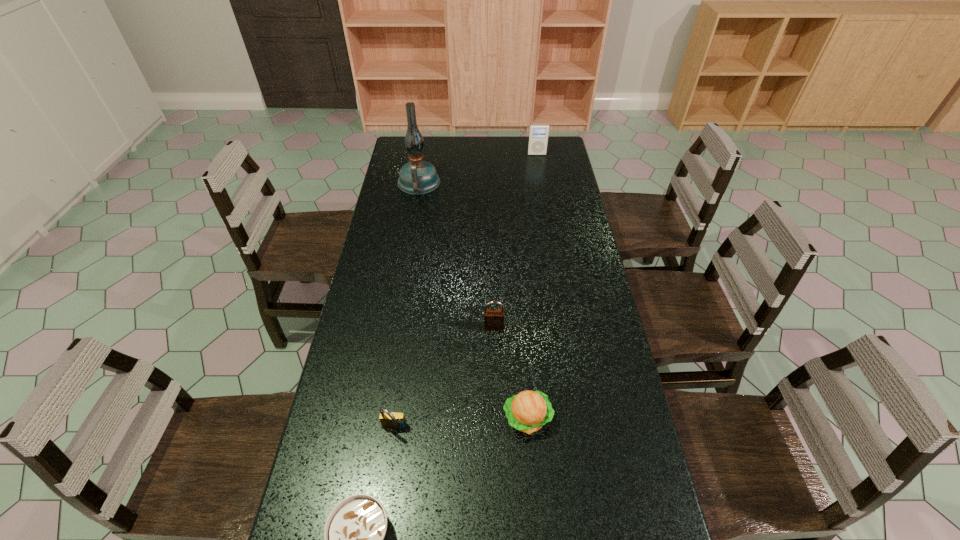
Image resolution: width=960 pixels, height=540 pixels. In order to click on free space located 0.110m on the front-facing side of the rightmost object in this screenshot , I will do `click(540, 169)`.

Identify the location of free space located 0.050m on the front-facing side of the farther padlock. Image resolution: width=960 pixels, height=540 pixels. (494, 345).

Locate an element on the screen. Image resolution: width=960 pixels, height=540 pixels. vacant space located on the side with the combination dials of the shorter padlock is located at coordinates (387, 483).

The image size is (960, 540). In order to click on vacant space located on the back of the hamburger in this screenshot , I will do `click(520, 334)`.

Where is `object at the far edge`? object at the far edge is located at coordinates (538, 136).

Locate an element on the screen. The height and width of the screenshot is (540, 960). oil lamp at the left edge is located at coordinates (417, 177).

The width and height of the screenshot is (960, 540). What are the coordinates of `padlock located in the left edge section of the desktop` in the screenshot? It's located at (392, 420).

The image size is (960, 540). I want to click on object at the right edge, so click(538, 136).

This screenshot has width=960, height=540. I want to click on object that is at the far right corner, so click(x=538, y=136).

Where is `vacant space at the far edge of the desktop`? vacant space at the far edge of the desktop is located at coordinates (477, 152).